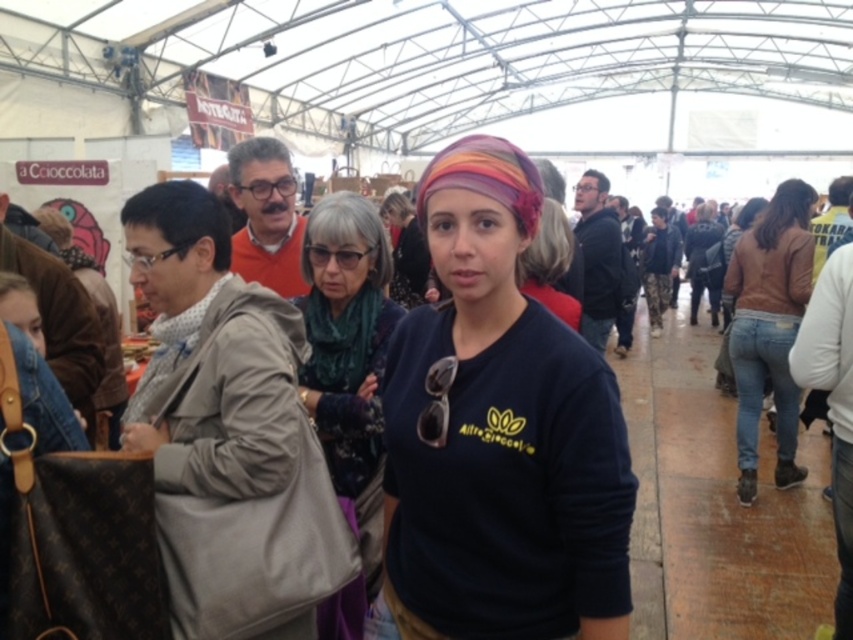
Question: Which point appears farthest from the camera in this image?

Choices:
 (A) (505, 550)
 (B) (769, 228)
 (C) (341, 352)

Answer: (B)

Question: Which of the following is the farthest from the observer?

Choices:
 (A) dark green textured scarf at center
 (B) brown denim jeans at right
 (C) dark blue jersey at center

Answer: (B)

Question: Which point is closer to the camera?

Choices:
 (A) dark green textured scarf at center
 (B) dark blue jersey at center

Answer: (B)

Question: Does dark blue jersey at center come behind dark green textured scarf at center?

Choices:
 (A) yes
 (B) no

Answer: (B)

Question: Does dark blue jersey at center appear over brown denim jeans at right?

Choices:
 (A) yes
 (B) no

Answer: (B)

Question: Can you confirm if dark green textured scarf at center is positioned below brown denim jeans at right?

Choices:
 (A) yes
 (B) no

Answer: (A)